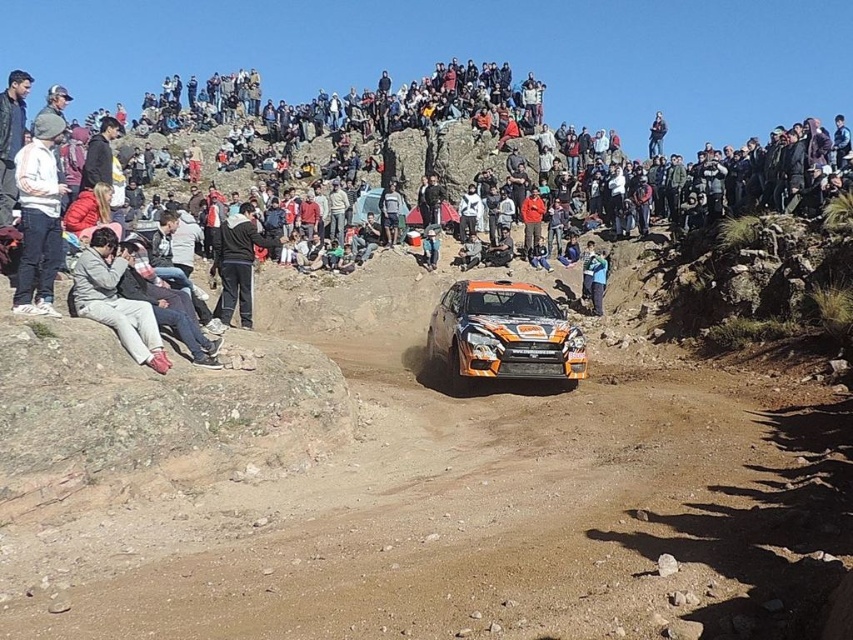
Can you confirm if orange matte dirt track at center is positioned to the right of light gray fabric pants at lower left?

Correct, you'll find orange matte dirt track at center to the right of light gray fabric pants at lower left.

Where is `orange matte dirt track at center`? orange matte dirt track at center is located at coordinates (508, 525).

Can you confirm if orange matte dirt track at center is positioned above black fabric jacket at center?

No, orange matte dirt track at center is not above black fabric jacket at center.

Is point (721, 614) less distant than point (213, 264)?

Yes, it is in front of point (213, 264).

Who is more distant from viewer, (518, 397) or (260, 244)?

The point (260, 244) is more distant.

The image size is (853, 640). Identify the location of orange matte dirt track at center. (508, 525).

Who is taller, orange matte car at center or light gray fabric pants at lower left?

orange matte car at center

Does orange matte car at center have a greater height compared to light gray fabric pants at lower left?

Correct, orange matte car at center is much taller as light gray fabric pants at lower left.

Between point (480, 96) and point (90, 289), which one is positioned in front?

Point (90, 289) is in front.

At what (x,y) coordinates should I click in order to perform the action: click on orange matte car at center. Please return your answer as a coordinate pair (x, y). This screenshot has width=853, height=640. Looking at the image, I should click on coord(505,164).